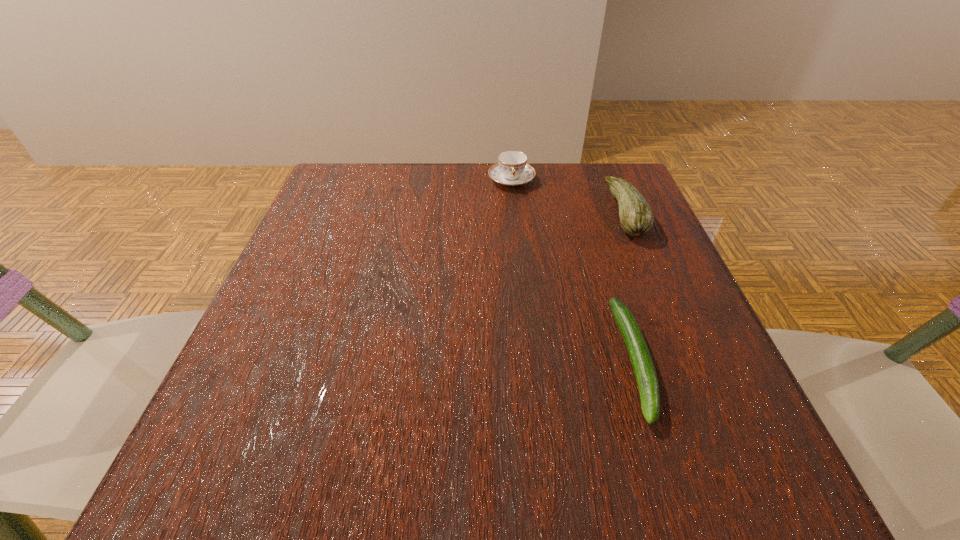
Where is `vacant region between the left zucchini and the leftmost object`? vacant region between the left zucchini and the leftmost object is located at coordinates (573, 270).

Image resolution: width=960 pixels, height=540 pixels. I want to click on free area in between the leftmost object and the second object from right to left, so click(573, 270).

At what (x,y) coordinates should I click in order to perform the action: click on free spot between the rightmost object and the second object from left to right. Please return your answer as a coordinate pair (x, y). Looking at the image, I should click on (630, 286).

Identify the location of free space between the second object from left to right and the leftmost object. (573, 270).

Identify the location of free space between the shorter zucchini and the leftmost object. (573, 270).

Where is `empty location between the left zucchini and the farther zucchini`? The width and height of the screenshot is (960, 540). empty location between the left zucchini and the farther zucchini is located at coordinates (630, 286).

The height and width of the screenshot is (540, 960). I want to click on empty space that is in between the teacup and the nearer zucchini, so click(573, 270).

Find the location of `unoccupied position between the shorter zucchini and the teacup`. unoccupied position between the shorter zucchini and the teacup is located at coordinates (573, 270).

The height and width of the screenshot is (540, 960). Find the location of `free space between the taller zucchini and the shortest object`. free space between the taller zucchini and the shortest object is located at coordinates (630, 286).

The image size is (960, 540). I want to click on free space between the teacup and the left zucchini, so click(x=573, y=270).